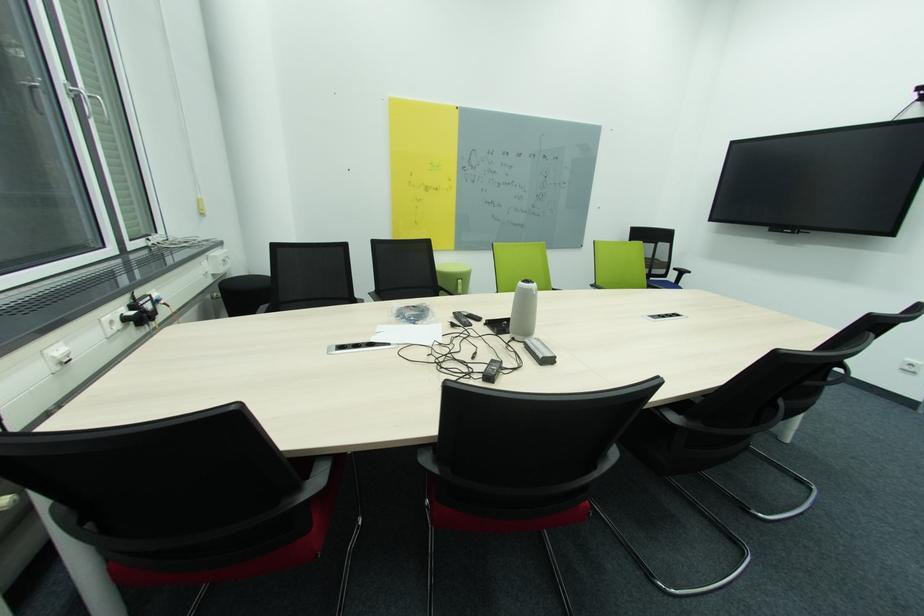
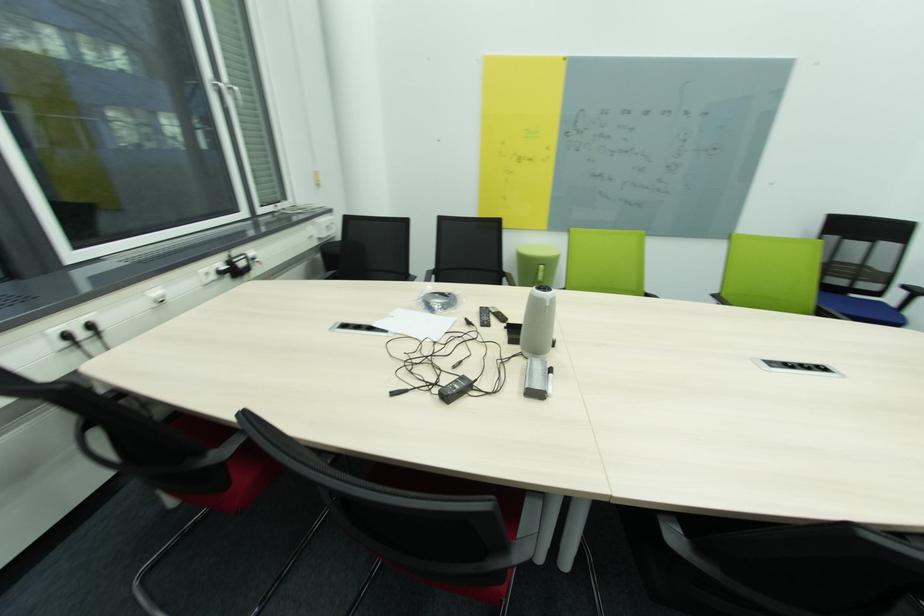
In the scene shown: Which direction would the cameraman need to move to produce the second image?

The cameraman moved toward right, forward.